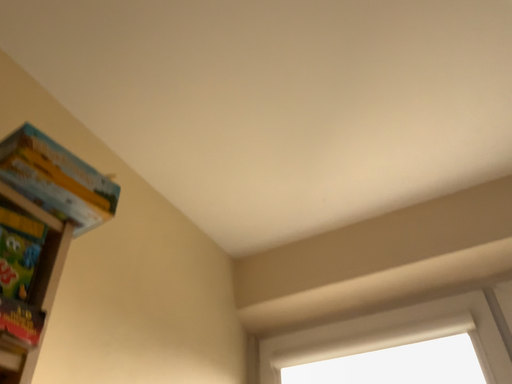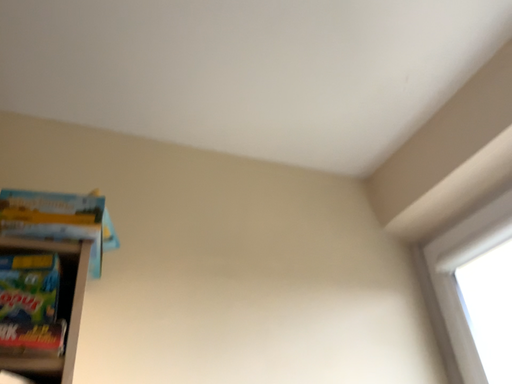
Question: Which way did the camera rotate in the video?

Choices:
 (A) rotated upward
 (B) rotated downward

Answer: (B)